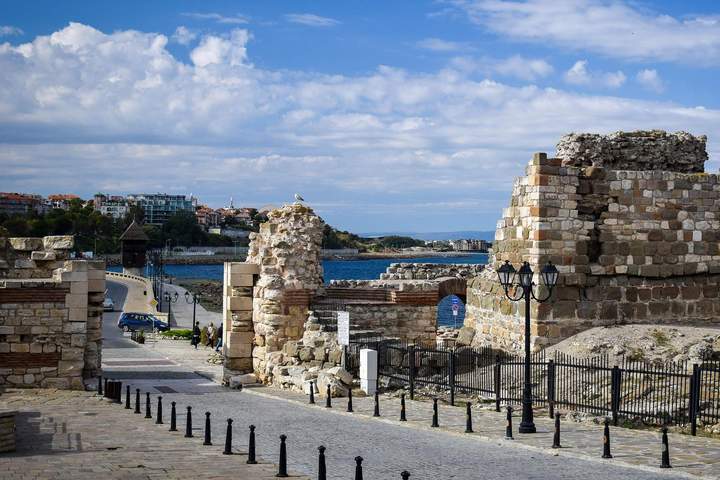
Identify the location of arch way. (449, 287).